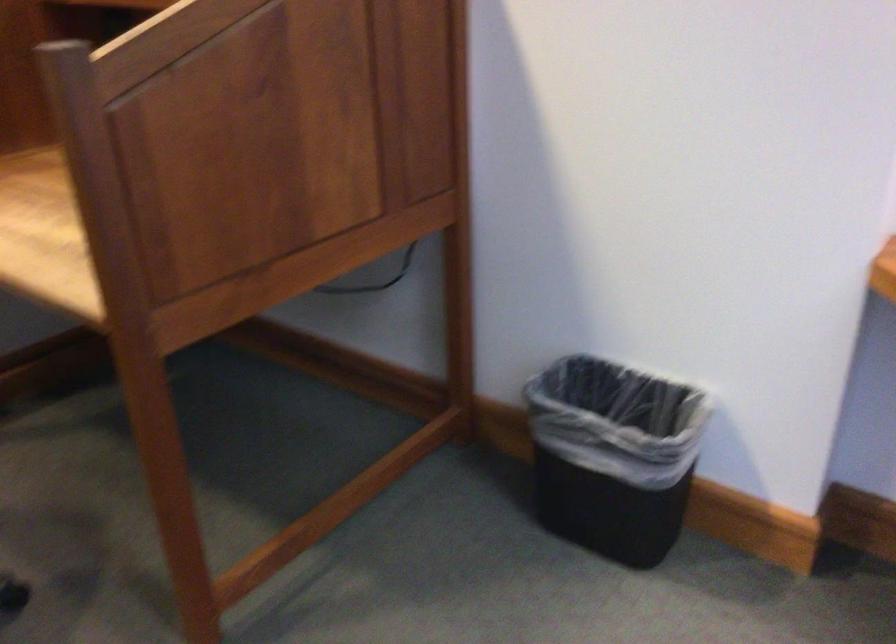
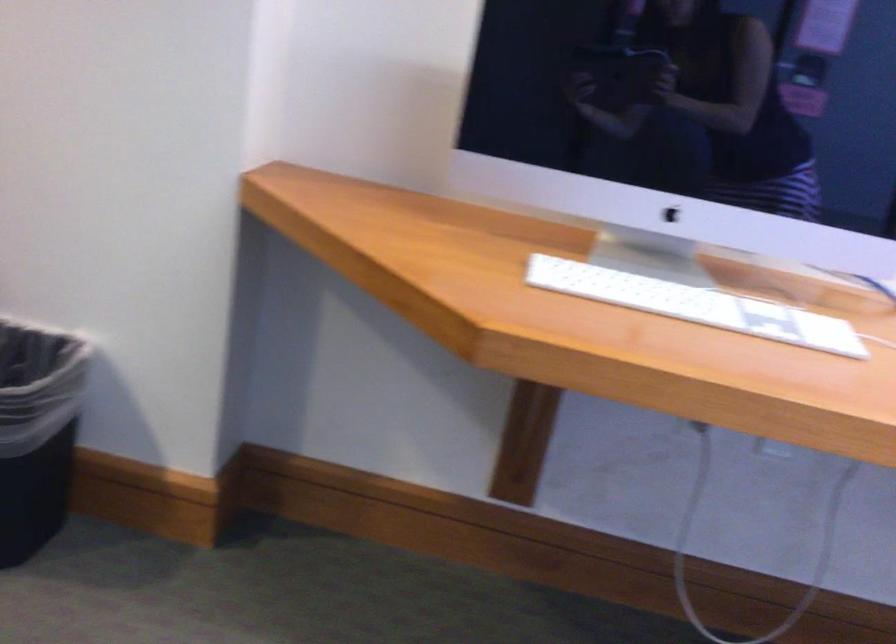
Locate, in the second image, the point that corresponds to pixel 679 467 in the first image.

(37, 431)